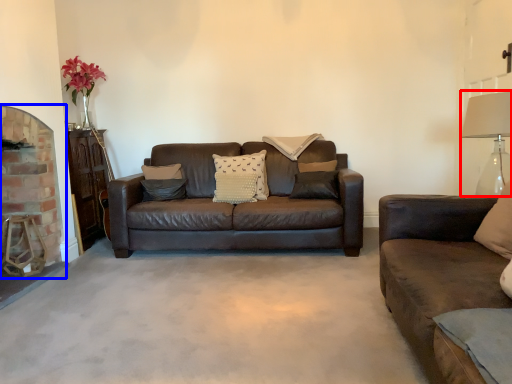
Question: Which of the following is the closest to the observer, table lamp (highlighted by a red box) or fireplace (highlighted by a blue box)?

Choices:
 (A) table lamp
 (B) fireplace

Answer: (A)